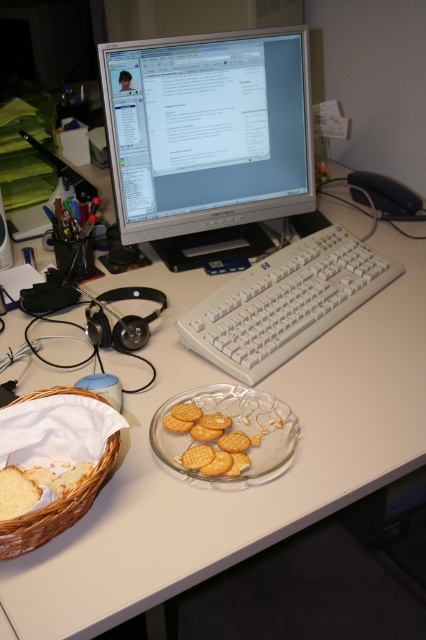
You are a remote worker trying to reach the white plastic keyboard at center without moving your chair. You can only lean forward. The satin silver monitor at upper center is in your way. Can you reach the keyboard while avoiding the monitor?

The satin silver monitor at upper center is further to the viewer than white plastic keyboard at center, meaning the keyboard is actually closer to you. Since the monitor is closer, it would block your reach to the keyboard. You might need to adjust the monitor or move slightly to access the keyboard.

You are a delivery robot trying to navigate to a specific location in the workspace. You need to move from point (342, 300) to point (17, 541). Given that you can only move forward and backward along the z axis, will you be able to reach the destination without moving sideways?

Point (342, 300) is further to the viewer than point (17, 541). Since you can only move along the z axis, you can move backward towards the destination point (17, 541) by decreasing your distance from the viewer, so yes, you can reach it without moving sideways.

You are a delivery person who needs to place a small package on the desk. The package is 60 centimeters long. You see the woven brown basket at lower left. Can you fit the package horizontally on the desk without moving the basket?

The woven brown basket at lower left is 64.34 centimeters from viewer. Since the package is 60 centimeters long, it can be placed horizontally on the desk as the distance from the basket to the viewer is greater than the package length, indicating sufficient space.